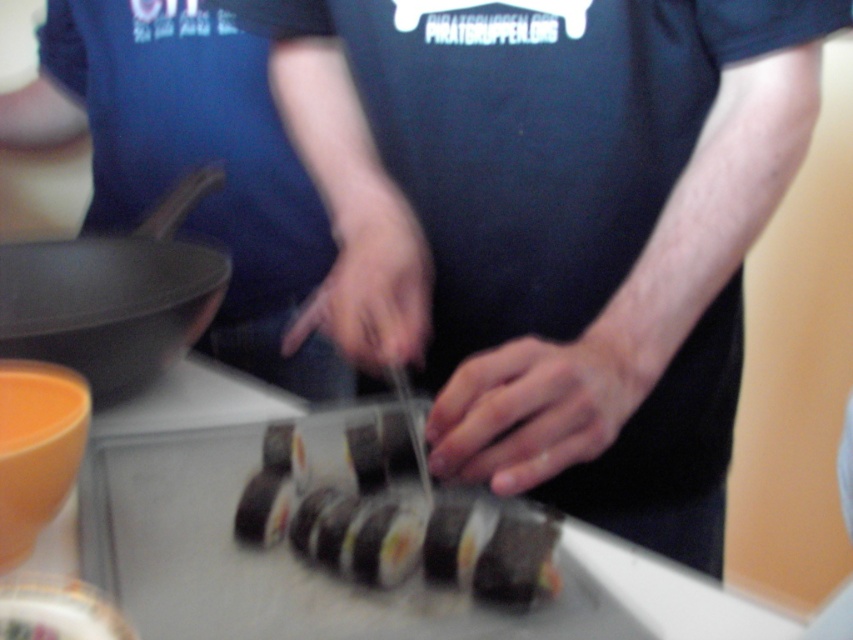
Question: Which object is farther from the camera taking this photo?

Choices:
 (A) matte black frying pan at left
 (B) black matte sushi at center
 (C) sushi at center

Answer: (A)

Question: Can you confirm if black matte sushi at center is positioned below matte black frying pan at left?

Choices:
 (A) no
 (B) yes

Answer: (A)

Question: Which point is farther from the camera taking this photo?

Choices:
 (A) (175, 266)
 (B) (811, 70)

Answer: (A)

Question: Can you confirm if black matte sushi at center is positioned to the right of sushi at center?

Choices:
 (A) no
 (B) yes

Answer: (B)

Question: Is sushi at center below matte black frying pan at left?

Choices:
 (A) yes
 (B) no

Answer: (A)

Question: Which point appears farthest from the camera in this image?

Choices:
 (A) (450, 28)
 (B) (283, 474)

Answer: (A)